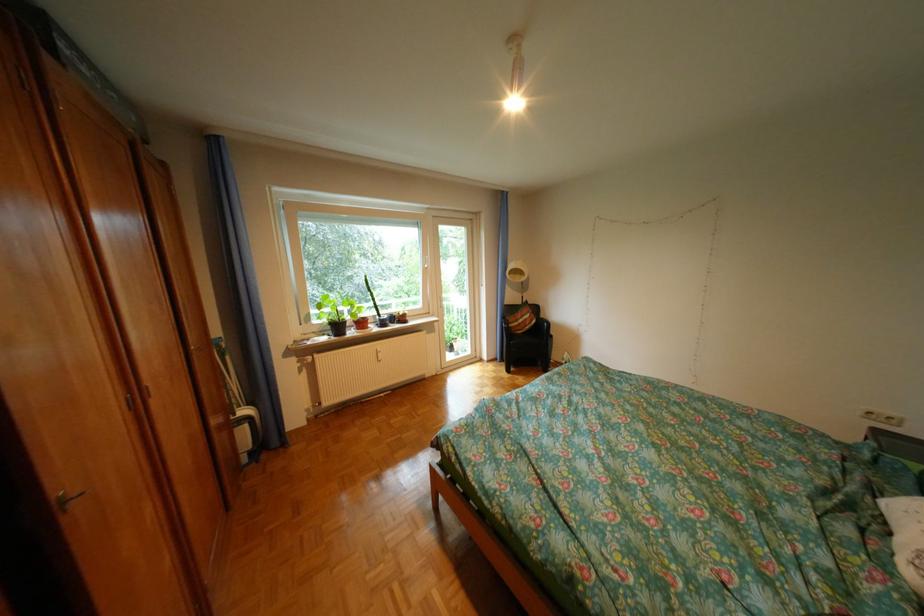
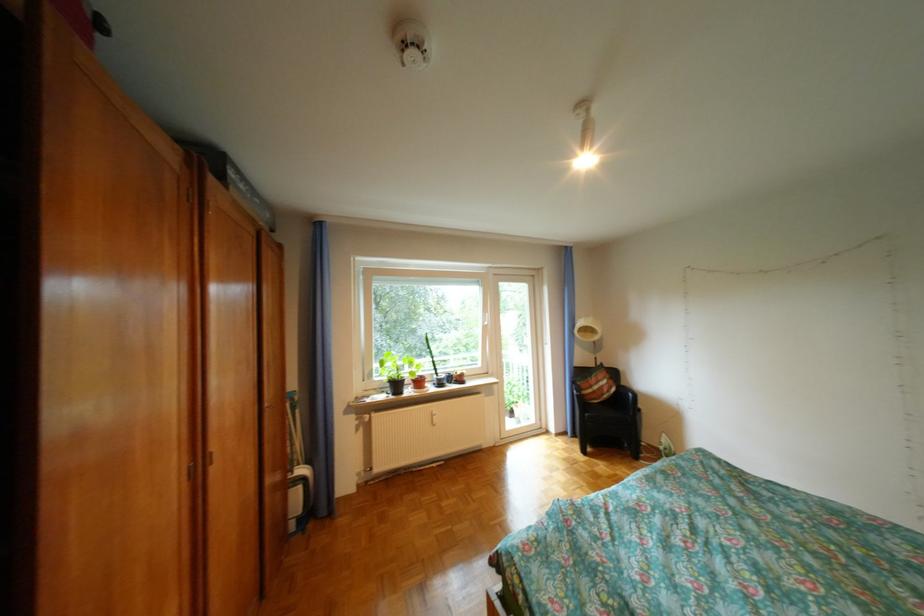
The point at (261, 411) is marked in the first image. Where is the corresponding point in the second image?

(317, 471)